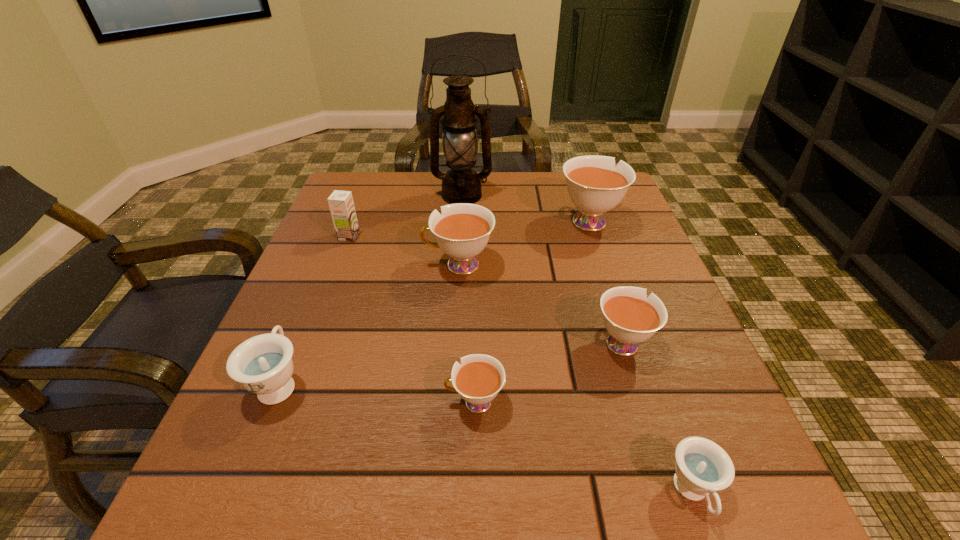
The width and height of the screenshot is (960, 540). In the image, there is a desktop. Identify the location of free space at the near left corner. (293, 502).

In order to click on free point between the second farthest teacup and the biggest white teacup in this screenshot , I will do (x=524, y=242).

At what (x,y) coordinates should I click in order to perform the action: click on free space between the biggest white teacup and the smaller blue teacup. Please return your answer as a coordinate pair (x, y). Looking at the image, I should click on (640, 356).

Where is `free spot between the brown chocolate milk and the second farthest white teacup`? The width and height of the screenshot is (960, 540). free spot between the brown chocolate milk and the second farthest white teacup is located at coordinates (404, 251).

The width and height of the screenshot is (960, 540). Identify the location of vacant space that is in between the leftmost teacup and the second farthest teacup. (370, 323).

Identify the location of free spot between the right blue teacup and the farthest white teacup. The image size is (960, 540). (640, 356).

You are a GUI agent. You are given a task and a screenshot of the screen. Output one action in this format:
    pyautogui.click(x=<x>, y=<y>)
    Task: Click on the vacant space that is in between the second nearest white teacup and the bigger blue teacup
    The height and width of the screenshot is (540, 960).
    Given the screenshot: What is the action you would take?
    pyautogui.click(x=450, y=362)

Where is `free area in between the oil lamp and the chocolate milk`? The image size is (960, 540). free area in between the oil lamp and the chocolate milk is located at coordinates (405, 216).

Image resolution: width=960 pixels, height=540 pixels. Find the location of `vacant space that's between the fifth nearest object and the second smallest white teacup`. vacant space that's between the fifth nearest object and the second smallest white teacup is located at coordinates (540, 303).

Identify the location of the third closest object relative to the biggest white teacup. (630, 317).